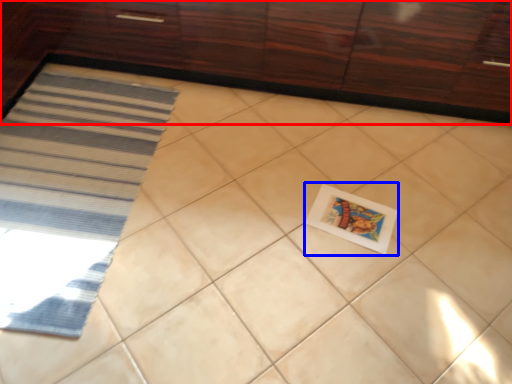
Question: Which object is further to the camera taking this photo, cabinetry (highlighted by a red box) or postcard (highlighted by a blue box)?

Choices:
 (A) cabinetry
 (B) postcard

Answer: (B)